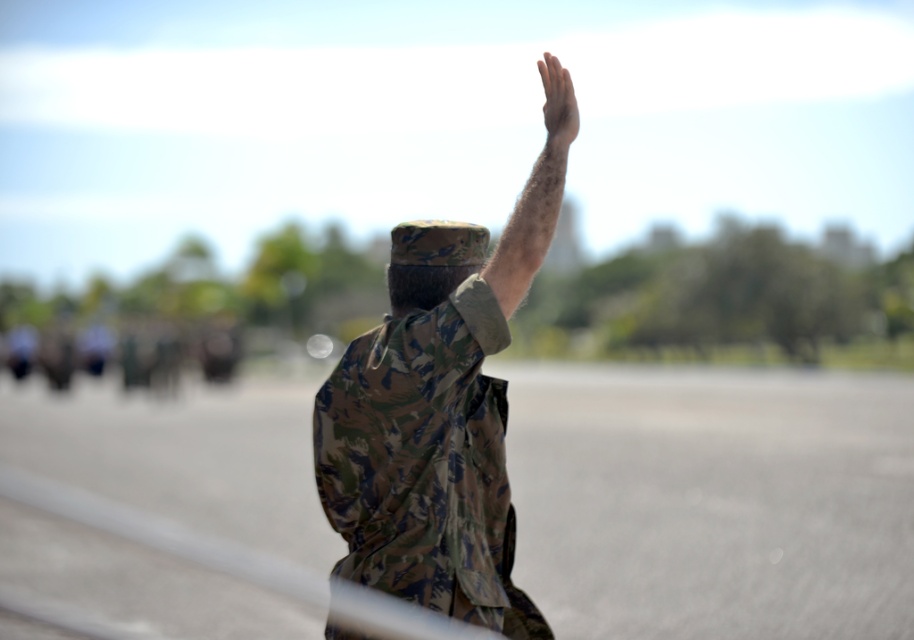
Question: Can you confirm if hairy skin at upper center is positioned below smooth skin hand at upper right?

Choices:
 (A) yes
 (B) no

Answer: (A)

Question: Which point appears closest to the camera in this image?

Choices:
 (A) (509, 276)
 (B) (561, 115)

Answer: (A)

Question: Does camo fabric uniform at center have a lesser width compared to smooth skin hand at upper right?

Choices:
 (A) no
 (B) yes

Answer: (A)

Question: Which of the following is the farthest from the observer?

Choices:
 (A) (551, 120)
 (B) (490, 285)

Answer: (A)

Question: Does hairy skin at upper center appear over smooth skin hand at upper right?

Choices:
 (A) no
 (B) yes

Answer: (A)

Question: Which point is farther to the camera?

Choices:
 (A) (541, 224)
 (B) (413, 236)

Answer: (B)